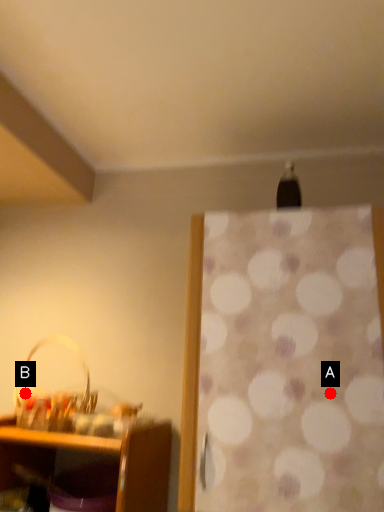
Question: Two points are circled on the image, labeled by A and B beside each circle. Which point is closer to the camera?

Choices:
 (A) A is closer
 (B) B is closer

Answer: (A)